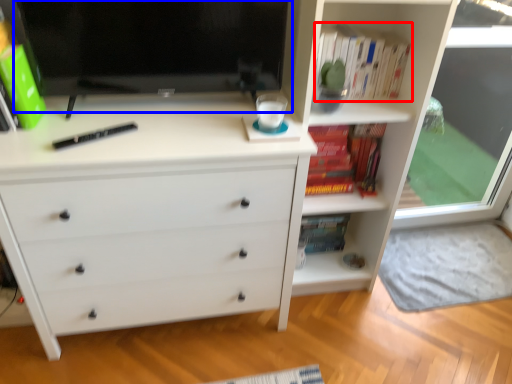
Question: Which of the following is the farthest to the observer, book (highlighted by a red box) or computer monitor (highlighted by a blue box)?

Choices:
 (A) book
 (B) computer monitor

Answer: (A)